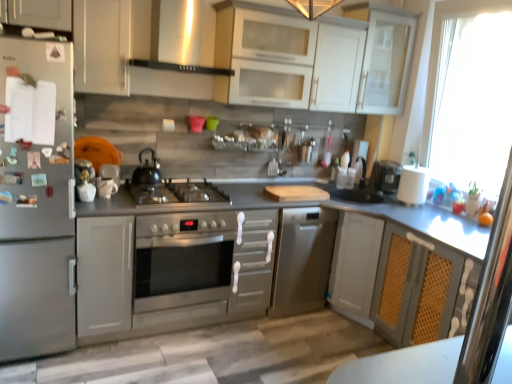
Locate an element on the screen. free space below black matte exhaust hood at upper center (from a real-world perspective) is located at coordinates (183, 185).